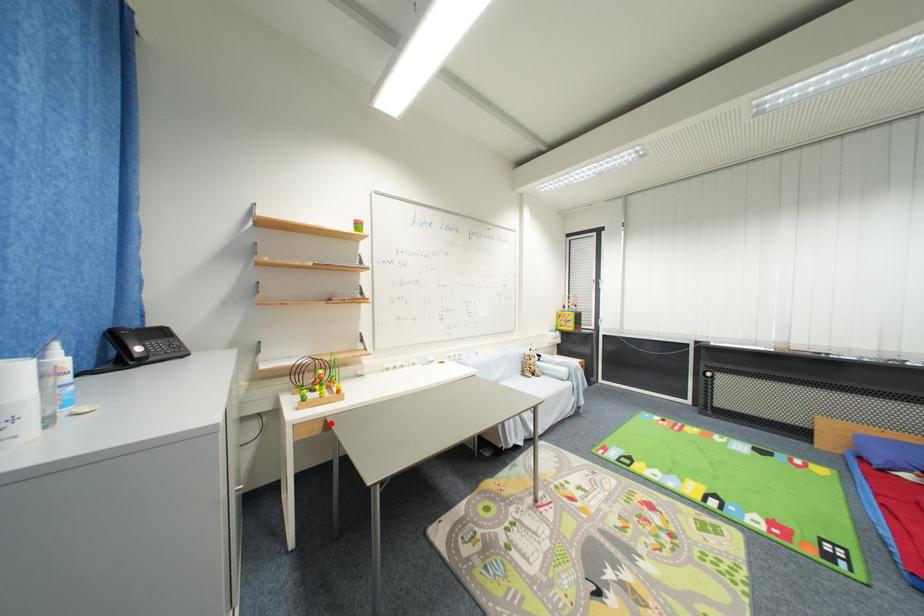
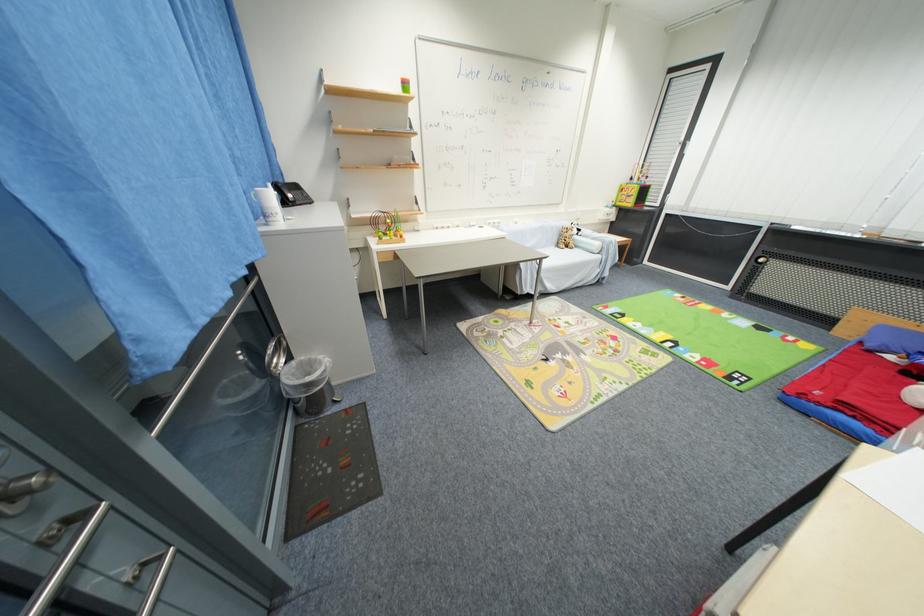
Find the pixel in the second image that matches the highlighted location in the first image.

(399, 254)